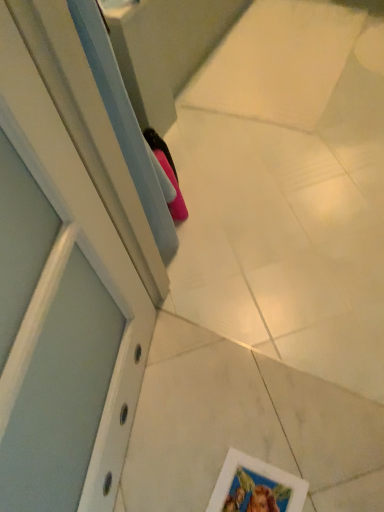
Question: Is white matte picture frame at lower right wider or thinner than pink matte shoe at center?

Choices:
 (A) wide
 (B) thin

Answer: (A)

Question: Is white matte picture frame at lower right situated inside pink matte shoe at center or outside?

Choices:
 (A) outside
 (B) inside

Answer: (A)

Question: Is white matte picture frame at lower right to the left or to the right of pink matte shoe at center in the image?

Choices:
 (A) right
 (B) left

Answer: (A)

Question: From the image's perspective, is pink matte shoe at center located above or below white matte picture frame at lower right?

Choices:
 (A) below
 (B) above

Answer: (B)

Question: Considering the positions of pink matte shoe at center and white matte picture frame at lower right in the image, is pink matte shoe at center wider or thinner than white matte picture frame at lower right?

Choices:
 (A) thin
 (B) wide

Answer: (A)

Question: Is pink matte shoe at center inside the boundaries of white matte picture frame at lower right, or outside?

Choices:
 (A) outside
 (B) inside

Answer: (A)

Question: Is pink matte shoe at center taller or shorter than white matte picture frame at lower right?

Choices:
 (A) tall
 (B) short

Answer: (A)